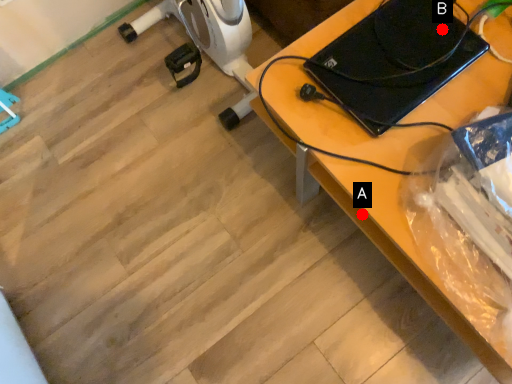
Question: Two points are circled on the image, labeled by A and B beside each circle. Which point is closer to the camera?

Choices:
 (A) A is closer
 (B) B is closer

Answer: (A)